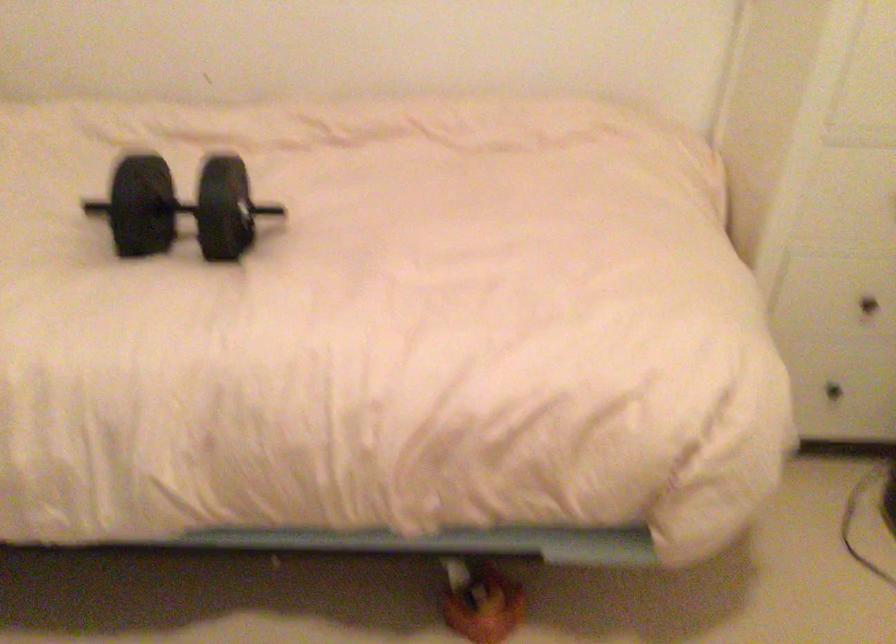
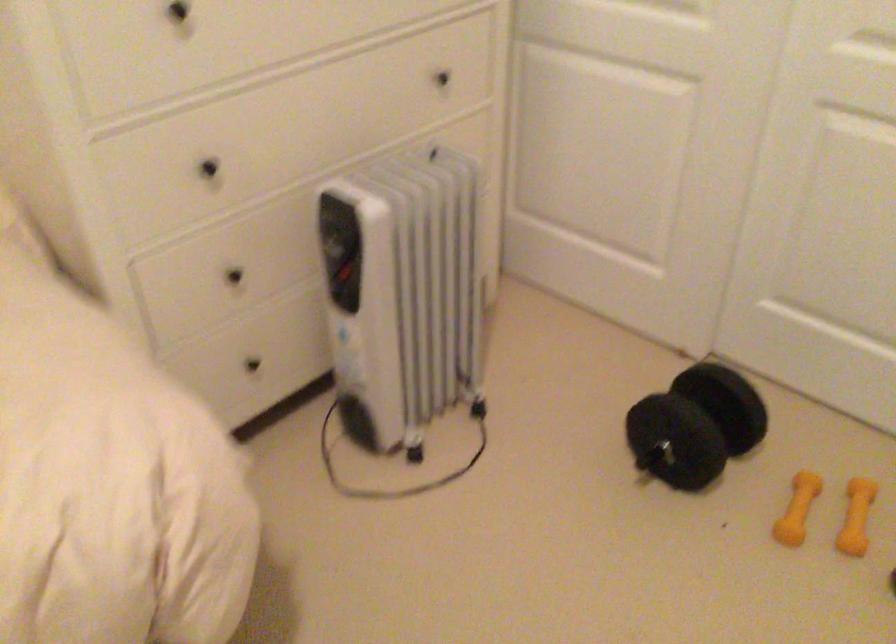
Question: The camera is either moving clockwise (left) or counter-clockwise (right) around the object. The first image is from the beginning of the video and the second image is from the end. Is the camera moving left or right when shooting the video?

Choices:
 (A) Left
 (B) Right

Answer: (A)